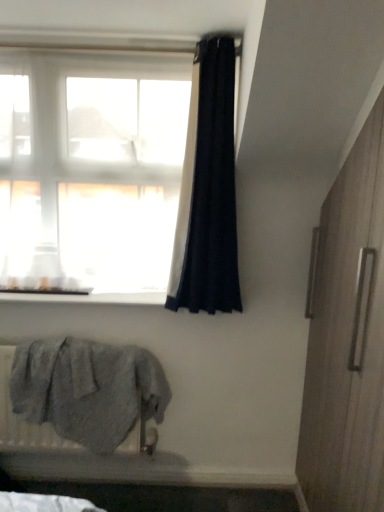
Question: Is black fabric curtain at upper center at the left side of wooden screen door at right?

Choices:
 (A) no
 (B) yes

Answer: (B)

Question: Is black fabric curtain at upper center directly adjacent to wooden screen door at right?

Choices:
 (A) no
 (B) yes

Answer: (A)

Question: From a real-world perspective, is black fabric curtain at upper center located beneath wooden screen door at right?

Choices:
 (A) yes
 (B) no

Answer: (B)

Question: Can you confirm if black fabric curtain at upper center is bigger than wooden screen door at right?

Choices:
 (A) yes
 (B) no

Answer: (B)

Question: Considering the relative sizes of black fabric curtain at upper center and wooden screen door at right in the image provided, is black fabric curtain at upper center thinner than wooden screen door at right?

Choices:
 (A) no
 (B) yes

Answer: (A)

Question: Is black fabric curtain at upper center outside wooden screen door at right?

Choices:
 (A) yes
 (B) no

Answer: (A)

Question: Is the depth of white smooth window sill at lower left greater than that of gray fluffy towel at lower left?

Choices:
 (A) yes
 (B) no

Answer: (A)

Question: Does white smooth window sill at lower left have a lesser height compared to gray fluffy towel at lower left?

Choices:
 (A) no
 (B) yes

Answer: (B)

Question: From the image's perspective, is white smooth window sill at lower left located beneath gray fluffy towel at lower left?

Choices:
 (A) yes
 (B) no

Answer: (B)

Question: Is white smooth window sill at lower left next to gray fluffy towel at lower left?

Choices:
 (A) yes
 (B) no

Answer: (B)

Question: Can you confirm if white smooth window sill at lower left is positioned to the left of gray fluffy towel at lower left?

Choices:
 (A) no
 (B) yes

Answer: (A)

Question: From the image's perspective, is white smooth window sill at lower left on gray fluffy towel at lower left?

Choices:
 (A) yes
 (B) no

Answer: (A)

Question: From a real-world perspective, is white smooth window sill at lower left on black fabric curtain at upper center?

Choices:
 (A) yes
 (B) no

Answer: (B)